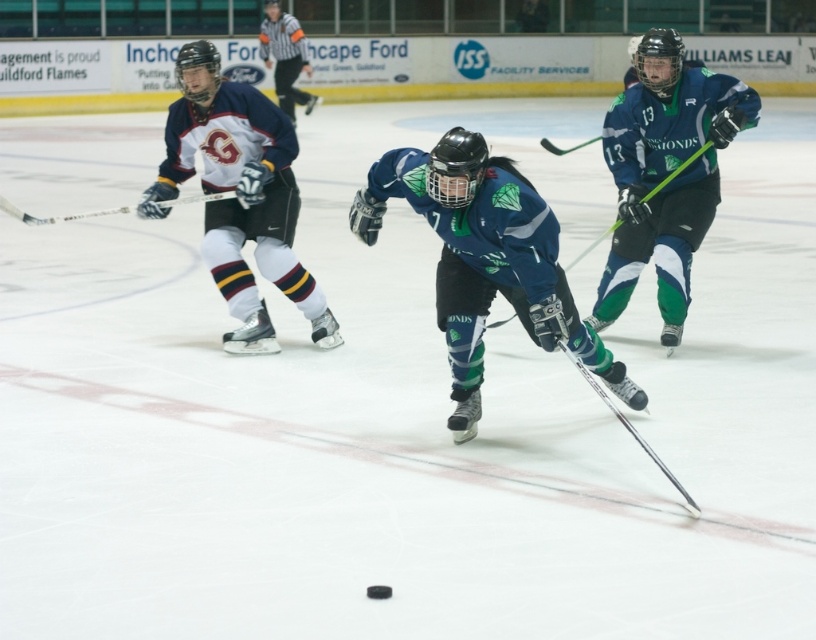
Question: Among these points, which one is nearest to the camera?

Choices:
 (A) pos(262,40)
 (B) pos(655,458)
 (C) pos(335,339)
 (D) pos(579,147)

Answer: (B)

Question: Is shiny blue hockey stick at center bigger than green matte hockey stick at center?

Choices:
 (A) yes
 (B) no

Answer: (A)

Question: Can you confirm if shiny blue hockey stick at center is positioned to the right of green matte hockey stick at center?

Choices:
 (A) no
 (B) yes

Answer: (A)

Question: Is white jersey at upper center to the left of shiny black hockey stick at center from the viewer's perspective?

Choices:
 (A) no
 (B) yes

Answer: (B)

Question: Based on their relative distances, which object is farther from the white matte jersey at left?

Choices:
 (A) white jersey at upper center
 (B) shiny black hockey stick at center
 (C) green matte hockey stick at right

Answer: (A)

Question: Which of the following is the closest to the observer?

Choices:
 (A) shiny black hockey stick at center
 (B) green matte hockey stick at right

Answer: (A)